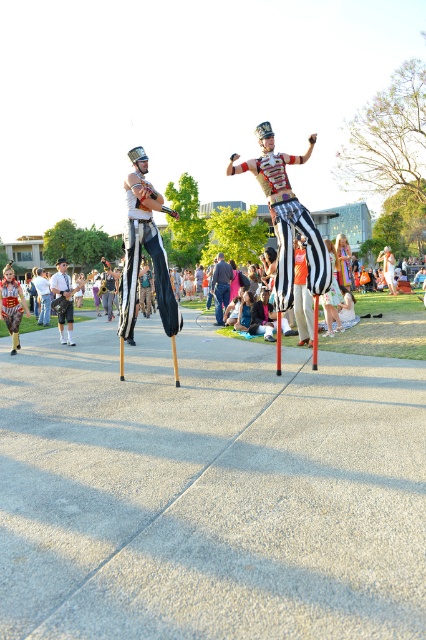
You are a photographer at the event and want to take a photo focusing on the black striped pants at center and denim pants at center. Which pair of pants will appear larger in the photo?

The black striped pants at center will appear larger in the photo because it is closer to the viewer than denim pants at center.

You are a photographer trying to capture the performer in denim pants at center. Where should you position your camera to ensure the performer is centered in your shot?

The denim pants at center is located at point 2D coordinates of [221,285], so you should position your camera to aim directly at that coordinate to center the performer in your shot.

You are a photographer at the event and want to capture both performers in a single frame. Given that the black striped pants at center and denim pants at center are part of their outfits, which performer should you focus on first to ensure both are in the frame?

The black striped pants at center is larger in size than denim pants at center, so you should focus on the performer with the black striped pants at center first to ensure both are in the frame.